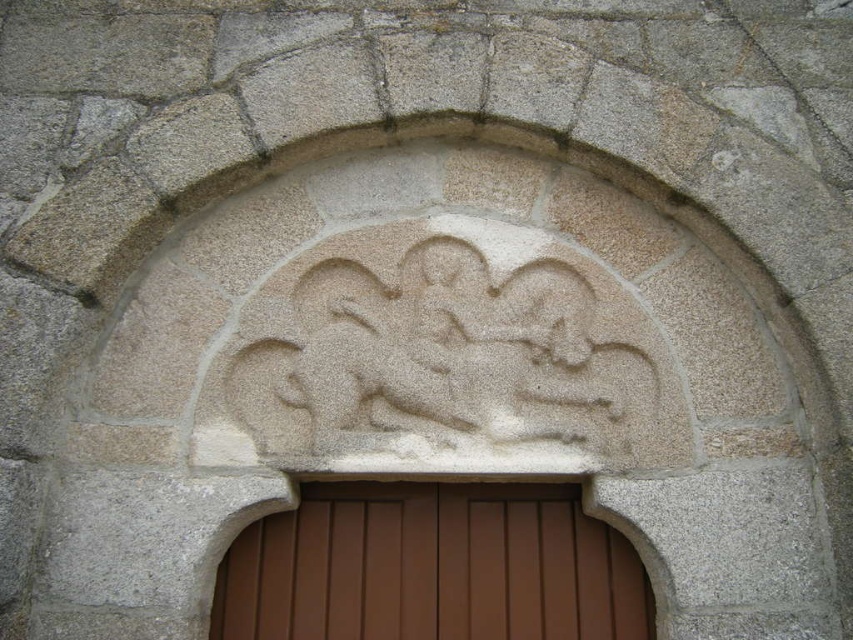
You are an architect examining the stone archway and notice the white stone carving at center and the brown wooden door at center. Which object is larger in size?

The white stone carving at center is bigger than the brown wooden door at center according to the description.

You are standing in front of a historical building and see the white stone carving at center and the brown wooden door at center. Which object is taller?

The white stone carving at center is taller than the brown wooden door at center.

You are standing in front of a historical building and see the white stone carving at center and the brown wooden door at center. Which object is closer to you?

The white stone carving at center is closer to you because it is in front of the brown wooden door at center.